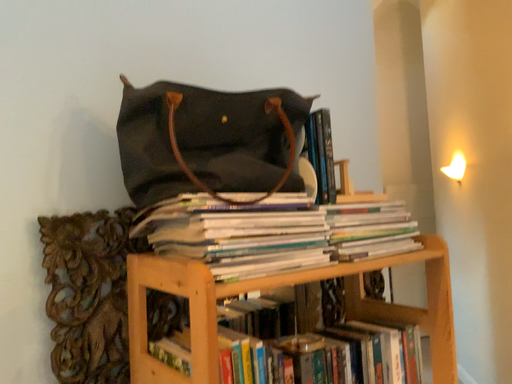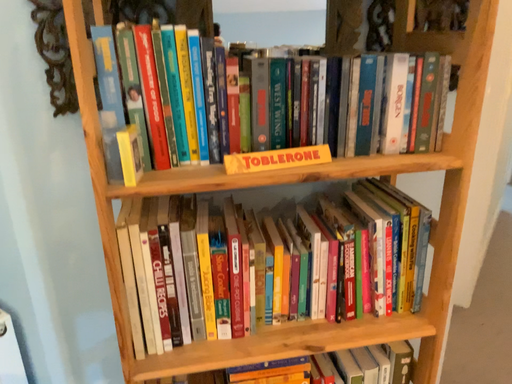
Question: Which way did the camera rotate in the video?

Choices:
 (A) rotated downward
 (B) rotated upward

Answer: (A)